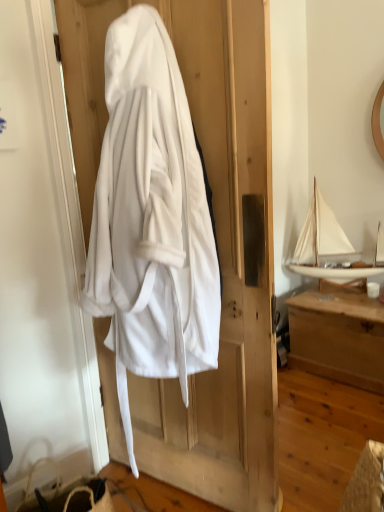
I want to click on vacant space situated above wooden chest at right (from a real-world perspective), so click(345, 298).